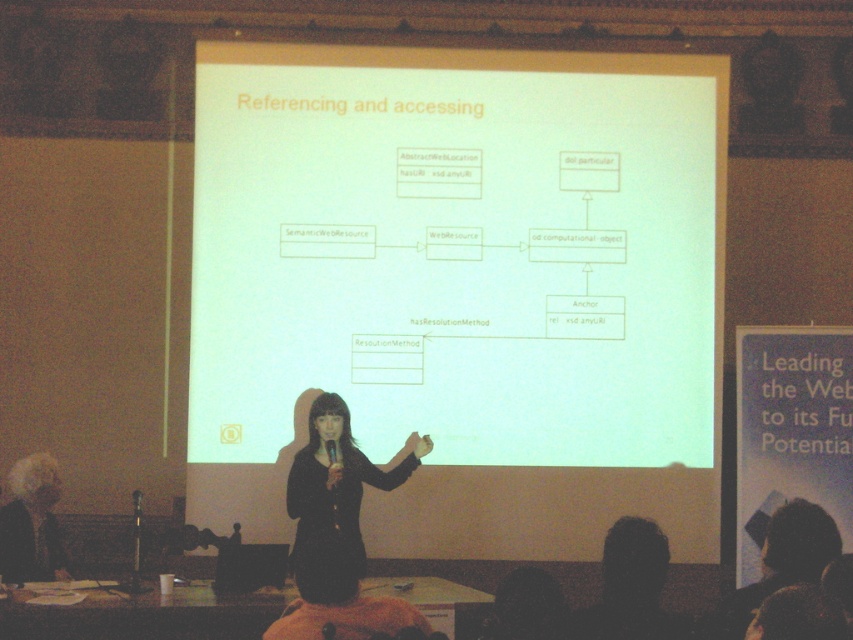
Question: Can you confirm if white matte projector screen at center is bigger than black fabric at center?

Choices:
 (A) yes
 (B) no

Answer: (B)

Question: Observing the image, what is the correct spatial positioning of white matte projector screen at center in reference to black fabric at center?

Choices:
 (A) below
 (B) above

Answer: (B)

Question: Which object appears closest to the camera in this image?

Choices:
 (A) white matte projector screen at center
 (B) black fabric at center

Answer: (B)

Question: Which object appears closest to the camera in this image?

Choices:
 (A) white matte projector screen at center
 (B) black fabric at center

Answer: (B)

Question: Which point is farther to the camera?

Choices:
 (A) (358, 522)
 (B) (466, 145)

Answer: (B)

Question: Can you confirm if white matte projector screen at center is wider than black fabric at center?

Choices:
 (A) yes
 (B) no

Answer: (A)